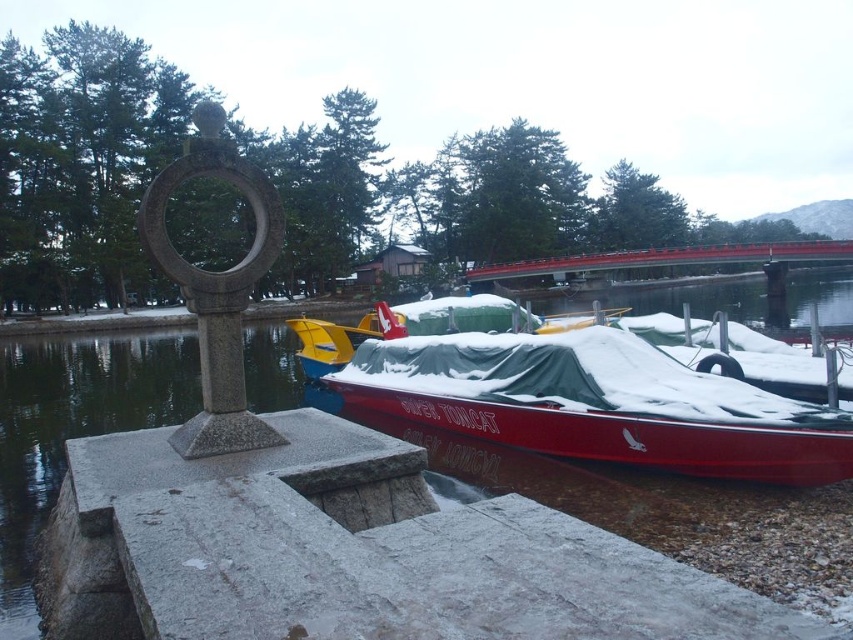
Question: Is red glossy boat at center positioned behind red wood bridge at upper center?

Choices:
 (A) yes
 (B) no

Answer: (B)

Question: Among these points, which one is farthest from the camera?

Choices:
 (A) (520, 272)
 (B) (804, 470)

Answer: (A)

Question: Can you confirm if red glossy boat at center is positioned above red wood bridge at upper center?

Choices:
 (A) no
 (B) yes

Answer: (A)

Question: Is red glossy boat at center positioned at the back of red wood bridge at upper center?

Choices:
 (A) no
 (B) yes

Answer: (A)

Question: Which point is closer to the camera taking this photo?

Choices:
 (A) (758, 252)
 (B) (688, 435)

Answer: (B)